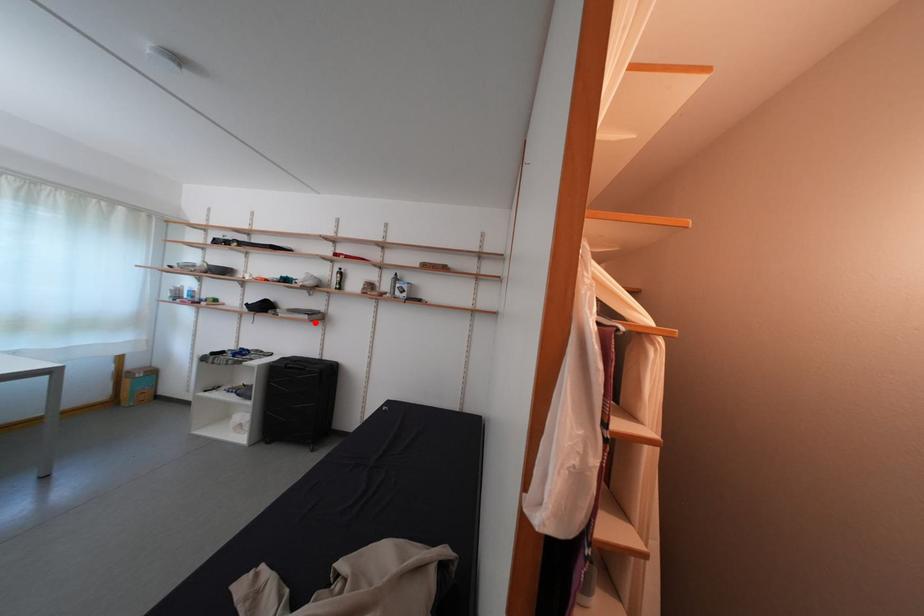
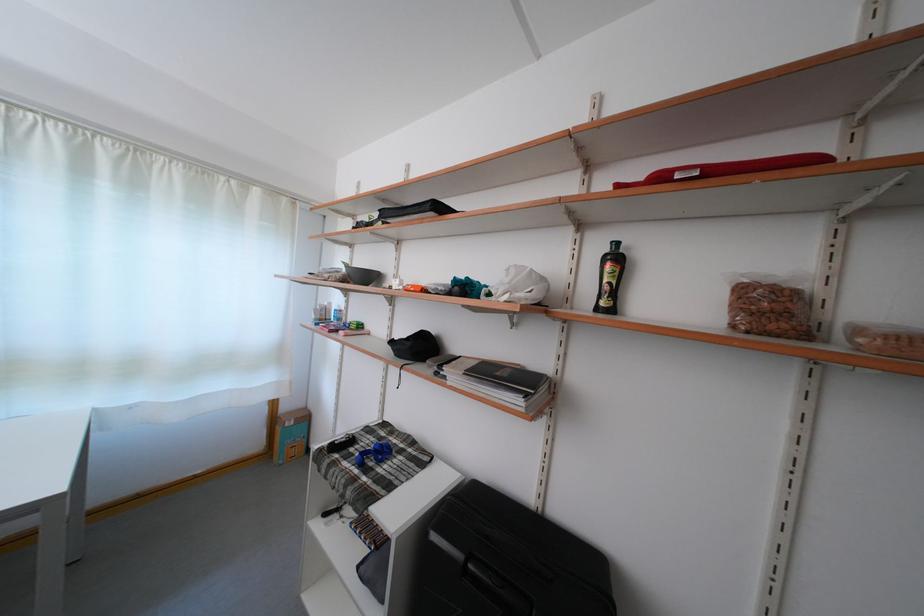
Where in the second image is the point corresponding to the highlighted location from the first image?

(527, 408)